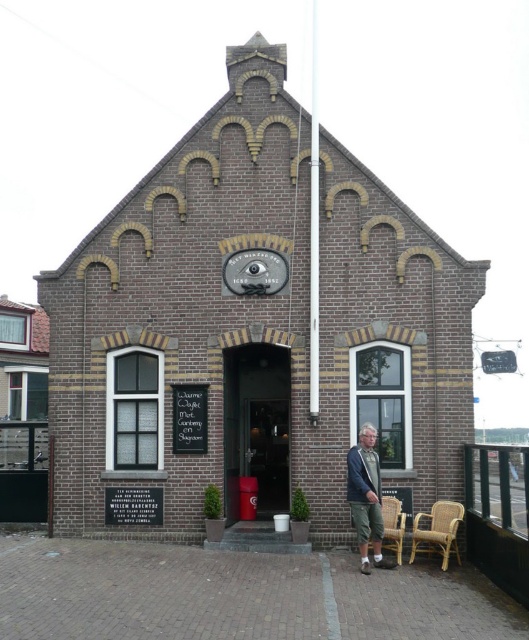
You are a delivery person who needs to place a large package on a shelf that can only hold items up to the height of the matte black clock at center. Given that the denim jacket at lower right is currently placed there, will the package fit?

The denim jacket at lower right is much taller than the matte black clock at center. Since the shelf can only hold items up to the height of the matte black clock at center, the denim jacket at lower right is too tall to fit, so the package cannot be placed there.

In the scene shown: You are standing at a point 29.23 meters away from the point marked as point (x=209, y=109) on the building. Based on the scene description, can you estimate how far you are from the building?

The point marked as point (x=209, y=109) is 29.23 meters away from you, so you are approximately 29.23 meters away from the building.

You are a delivery person standing at the entrance of the brick building. You need to place a package on either the denim jacket at lower right or the rattan chair at lower right. Which object can support the package better based on their heights?

The denim jacket at lower right has a greater height compared to the rattan chair at lower right, so it can support the package better as it is taller and more stable.